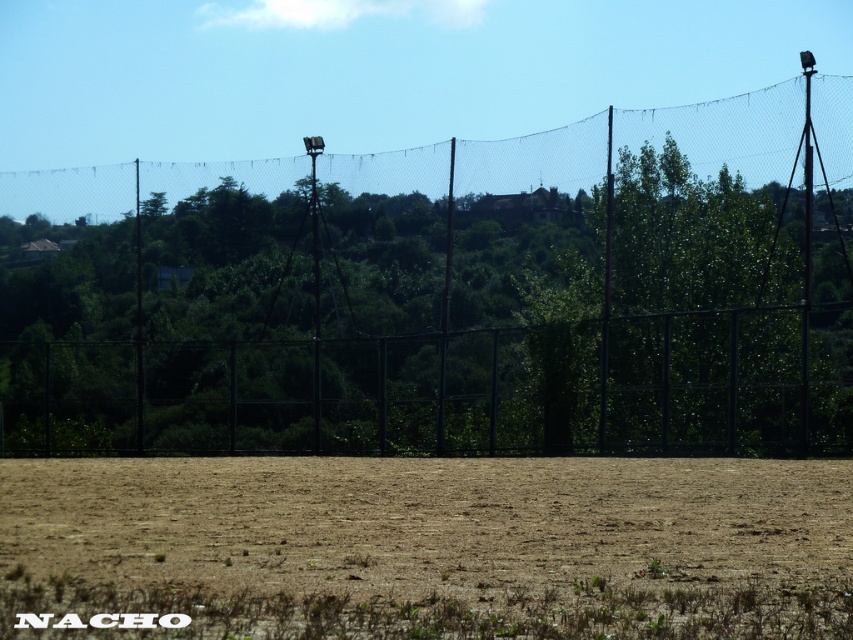
You are standing at the center of the image and want to walk towards the black wire mesh fence at upper center. What direction should you face to move directly toward it?

Since the black wire mesh fence at upper center is located at point coordinates of 0.459 on the x axis and 0.528 on the y axis, you should face slightly to the left and upwards to move directly toward it.

You are a landscape designer planning to install a new pathway. You need to know the spatial relationship between the black wire mesh fence at upper center and the brown sandy soil at center. Which one is wider?

The black wire mesh fence at upper center might be wider than brown sandy soil at center according to the description.

You are a landscape architect designing a new garden. You need to decide where to place a new decorative statue. The statue requires a solid foundation and cannot be placed on loose material. Based on the image, which area should you choose between the black wire mesh fence at upper center and the brown sandy soil at center?

The brown sandy soil at center is loose material, so the statue should be placed near the black wire mesh fence at upper center which has a larger size and likely provides a solid foundation.